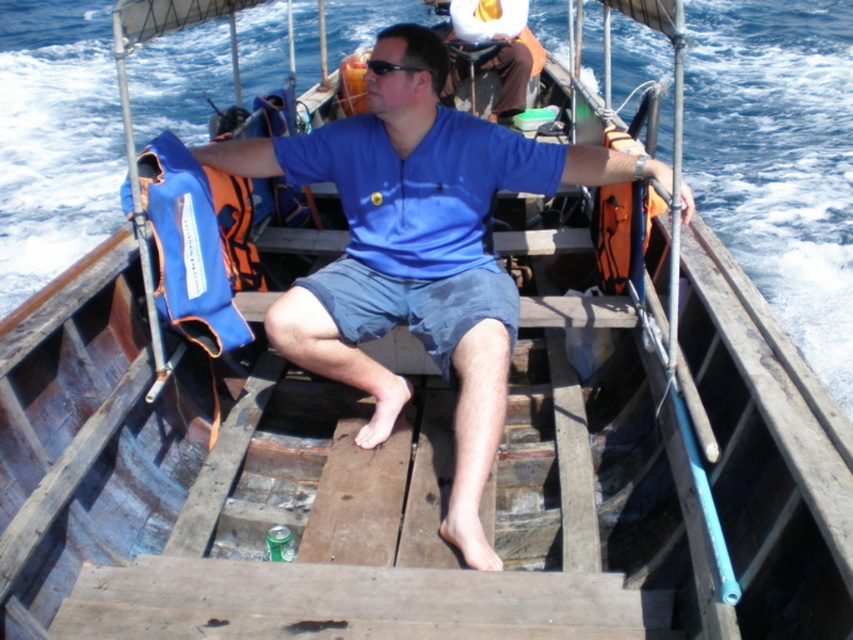
Question: Which point is closer to the camera?

Choices:
 (A) black plastic sunglasses at center
 (B) orange fabric life jacket at left
 (C) blue fabric life jacket at left

Answer: (C)

Question: Is blue fabric life jacket at left below black plastic sunglasses at center?

Choices:
 (A) yes
 (B) no

Answer: (A)

Question: Is blue fabric life jacket at left positioned behind black plastic sunglasses at center?

Choices:
 (A) yes
 (B) no

Answer: (B)

Question: Does blue fabric life jacket at left have a greater width compared to orange fabric life jacket at left?

Choices:
 (A) yes
 (B) no

Answer: (A)

Question: Which of the following is the farthest from the observer?

Choices:
 (A) (187, 156)
 (B) (376, 61)
 (C) (231, 269)

Answer: (C)

Question: Which point is closer to the camera?

Choices:
 (A) (152, 176)
 (B) (229, 157)

Answer: (A)